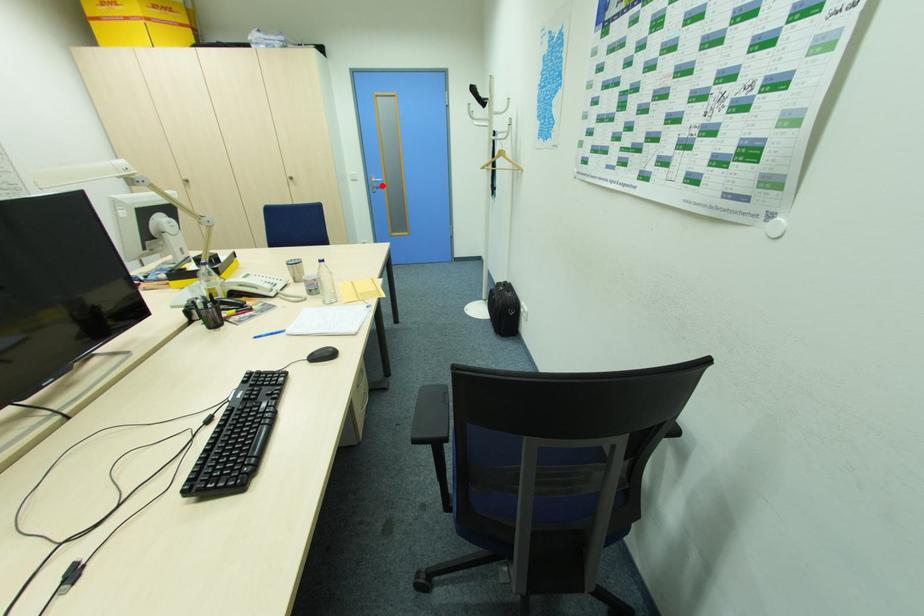
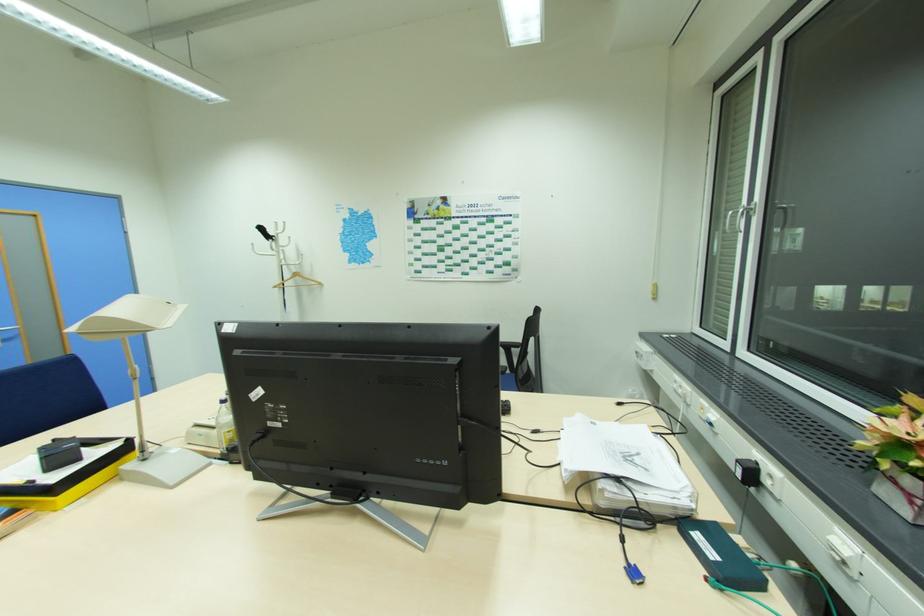
In the second image, find the point that corresponds to the highlighted location in the first image.

(11, 337)